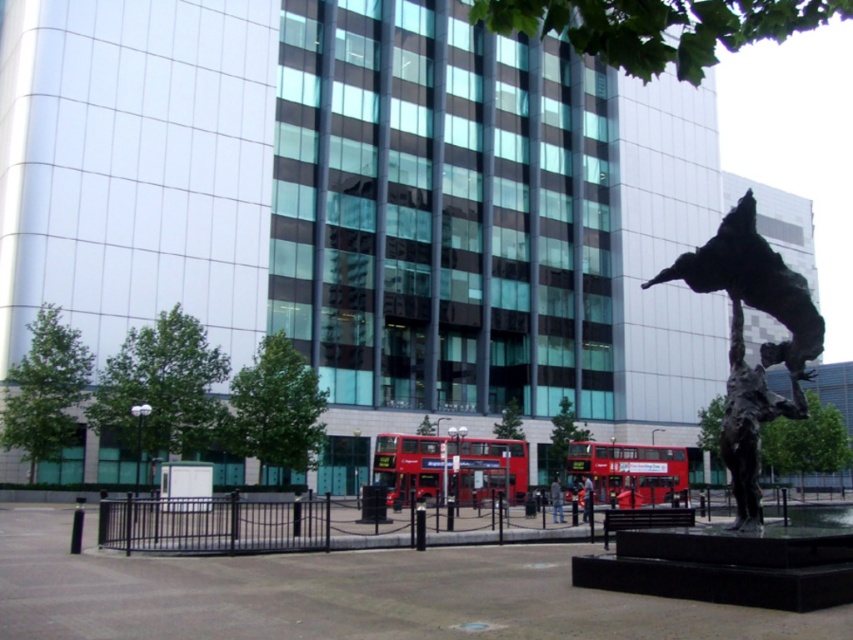
Question: Is bronze metallic statue at lower right to the left of dark gray fabric jacket at center from the viewer's perspective?

Choices:
 (A) no
 (B) yes

Answer: (A)

Question: Does red metallic bus at center appear over smooth bronze statue at center?

Choices:
 (A) yes
 (B) no

Answer: (B)

Question: Which point appears farthest from the camera in this image?

Choices:
 (A) (442, 445)
 (B) (662, 486)
 (C) (746, 452)
 (D) (558, 502)

Answer: (B)

Question: Does red metallic bus at center appear over dark gray fabric jacket at center?

Choices:
 (A) no
 (B) yes

Answer: (B)

Question: Which object is the farthest from the red rubber double-decker bus at center?

Choices:
 (A) smooth bronze statue at center
 (B) bronze metallic statue at lower right
 (C) dark gray fabric jacket at center
 (D) bronze metallic statue at right

Answer: (B)

Question: Which object appears closest to the camera in this image?

Choices:
 (A) red metallic bus at center
 (B) smooth bronze statue at center
 (C) bronze metallic statue at lower right
 (D) dark gray fabric jacket at center

Answer: (C)